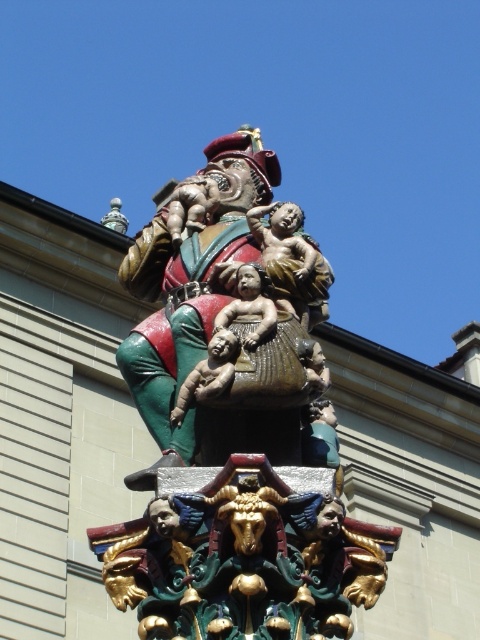
Question: Is polychrome wood carving at center smaller than bronze statue at center?

Choices:
 (A) no
 (B) yes

Answer: (B)

Question: Can you confirm if polychrome wood carving at center is wider than matte brown baby at center?

Choices:
 (A) yes
 (B) no

Answer: (A)

Question: Among these points, which one is nearest to the camera?

Choices:
 (A) (175, 420)
 (B) (252, 228)

Answer: (A)

Question: Which point is farther to the camera?

Choices:
 (A) (182, 396)
 (B) (227, 333)

Answer: (A)

Question: Does polychrome wood carving at center come behind bronze statue at center?

Choices:
 (A) yes
 (B) no

Answer: (B)

Question: Among these points, which one is nearest to the camera?

Choices:
 (A) (218, 268)
 (B) (157, 401)

Answer: (B)